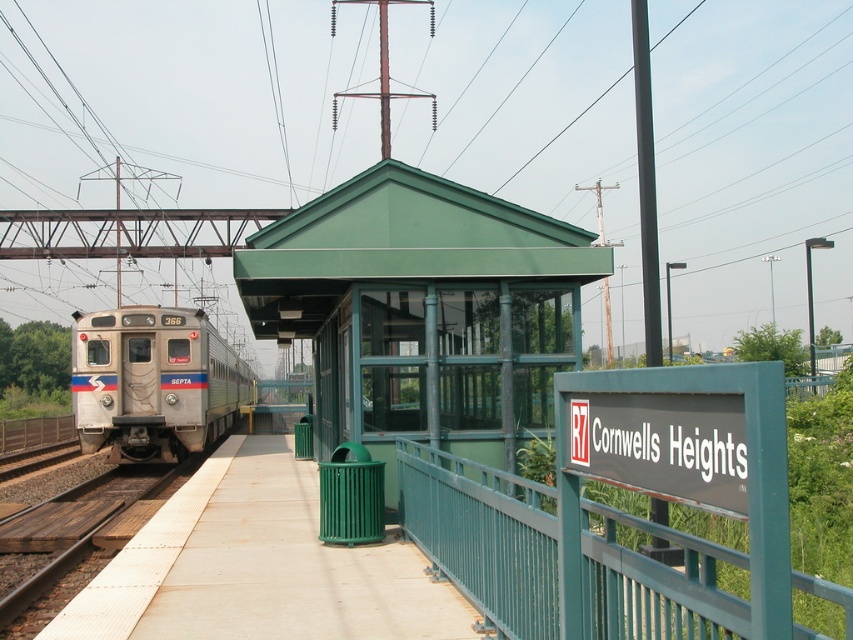
You are standing on the smooth concrete platform at center and want to board the silver metallic train at left. Which direction should you walk to reach the train?

You should walk towards the left side of the platform because the silver metallic train at left is above the smooth concrete platform at center, so the train is on the tracks to the left of the platform.

From the picture: You are a passenger on the platform at Cornwells Heights station. You need to board the SEPTA train numbered 366. Based on the scene, will you need to climb up steps or go down steps to reach the silver metallic train at left from the smooth concrete platform at center?

The smooth concrete platform at center is not as tall as the silver metallic train at left, so you will need to climb up steps to board the silver metallic train at left from the smooth concrete platform at center.